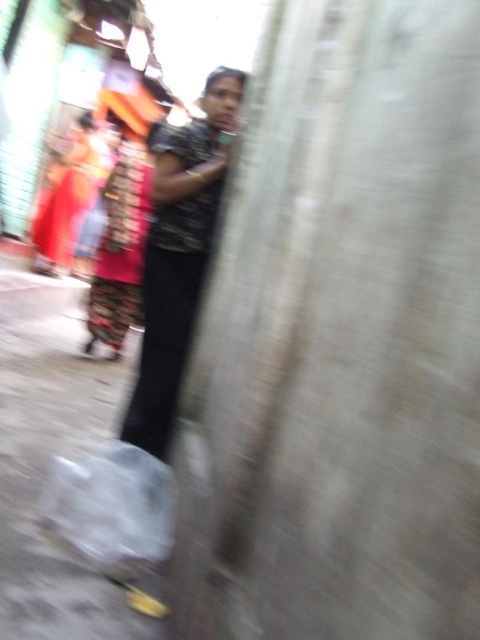
You are a photographer trying to capture a clear image of the two people in the scene. Given that the dark textured shirt at center is thinner than the shiny red fabric dress at center, which object would be easier to focus on and why?

The dark textured shirt at center would be easier to focus on because it is thinner than the shiny red fabric dress at center, making its edges and details more defined.

Looking at this image, you are a photographer trying to capture a clear image of the shiny red fabric dress at center and the matte red saree at left. Given the current blurry image, which object would appear more out of focus if the focus is on the foreground wall?

The shiny red fabric dress at center is positioned under the matte red saree at left, so if the focus is on the foreground wall, the matte red saree at left would be closer to the wall and thus more in focus, making the shiny red fabric dress at center appear more out of focus.

You are a photographer trying to capture a clear image of both the dark textured shirt at center and the shiny red fabric dress at center. Given the current blurry image, which object would appear more out of focus if the camera focuses on the other?

The dark textured shirt at center occupies less space than the shiny red fabric dress at center, so if the camera focuses on the shiny red fabric dress at center, the dark textured shirt at center would appear more out of focus.